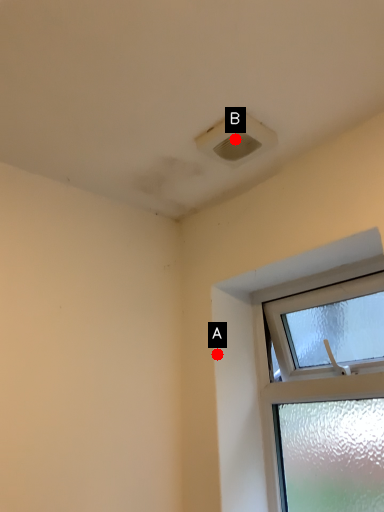
Question: Two points are circled on the image, labeled by A and B beside each circle. Which point is farther from the camera taking this photo?

Choices:
 (A) A is further
 (B) B is further

Answer: (A)